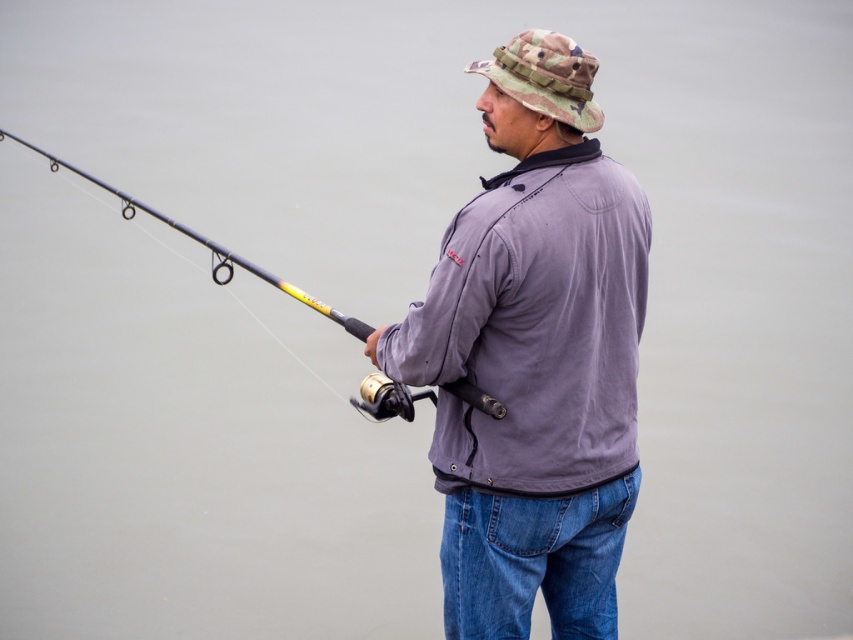
You are a photographer setting up a tripod to capture the man fishing. The tripod has a minimum distance requirement of 25 inches between the two objects to avoid obstruction. Can you place the tripod between the purple matte jacket at center and the camo fabric hat at upper center without blocking the view?

The purple matte jacket at center and camo fabric hat at upper center are 24.97 inches apart, which is less than the tripod minimum distance requirement of 25 inches. Therefore, placing the tripod between them would likely block the view.

You are a photographer trying to capture the perfect shot of the man fishing. You notice two points in the scene labeled as point (556, 92) and point (170, 221). Which point should you focus on to ensure it appears sharper in the photo?

Point (556, 92) is closer to the camera than point (170, 221), so focusing on point (556, 92) will make it appear sharper in the photo.